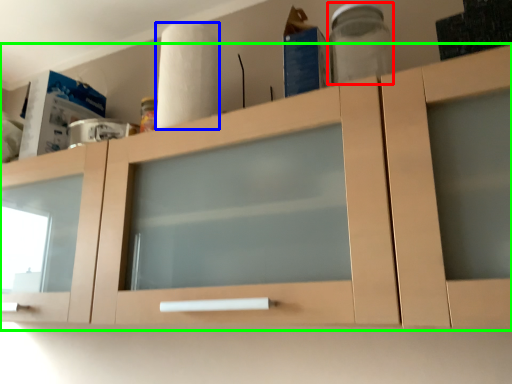
Question: Which object is positioned closest to glass jar (highlighted by a red box)? Select from paper towel (highlighted by a blue box) and cabinetry (highlighted by a green box).

Choices:
 (A) paper towel
 (B) cabinetry

Answer: (A)